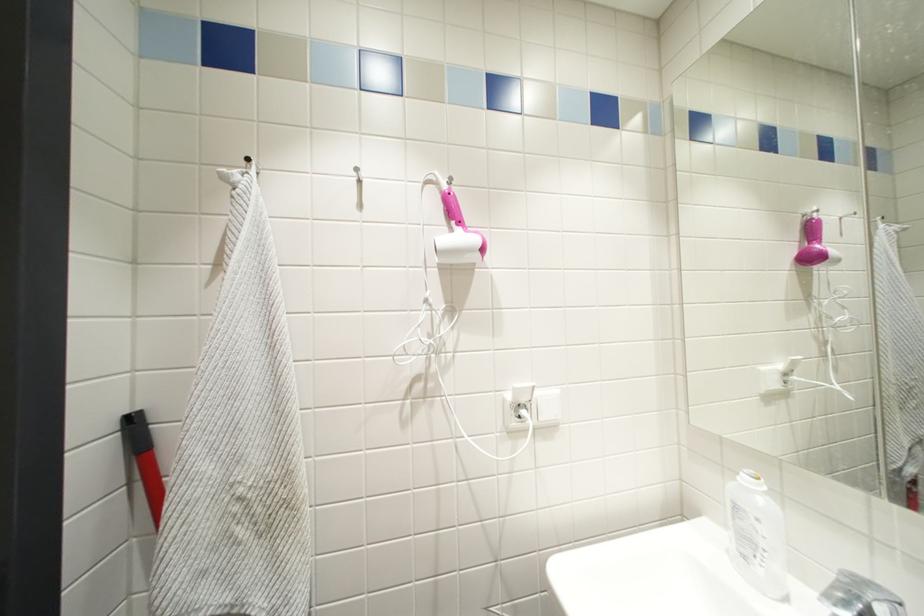
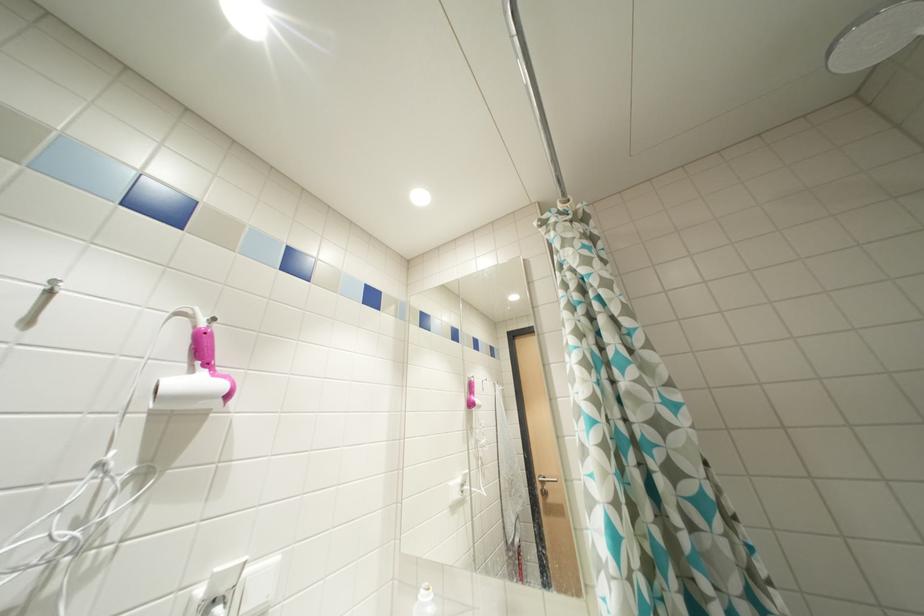
The images are taken continuously from a first-person perspective. In which direction is your viewpoint rotating?

The camera rotated toward right-up.